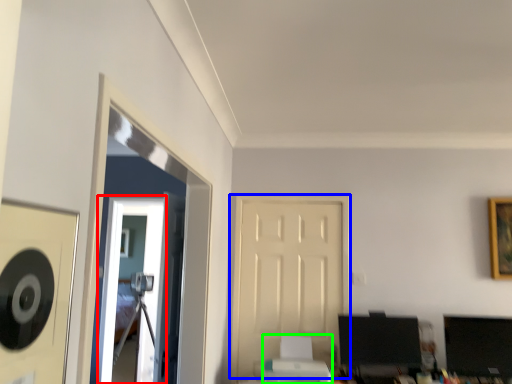
Question: Which object is positioned farthest from glass door (highlighted by a red box)? Select from door (highlighted by a blue box) and printer (highlighted by a green box).

Choices:
 (A) door
 (B) printer

Answer: (B)